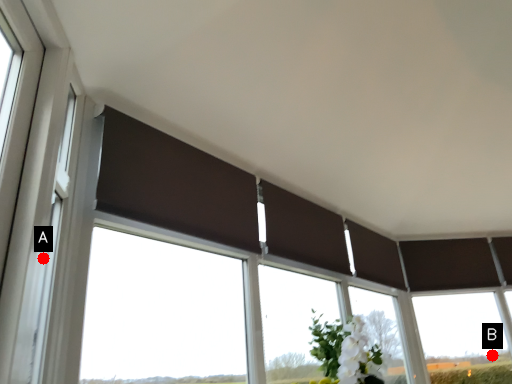
Question: Two points are circled on the image, labeled by A and B beside each circle. Which of the following is the closest to the observer?

Choices:
 (A) A is closer
 (B) B is closer

Answer: (A)